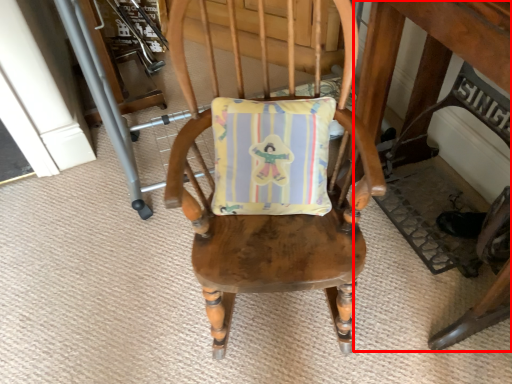
Question: In this image, where is table (annotated by the red box) located relative to chair?

Choices:
 (A) right
 (B) left

Answer: (A)